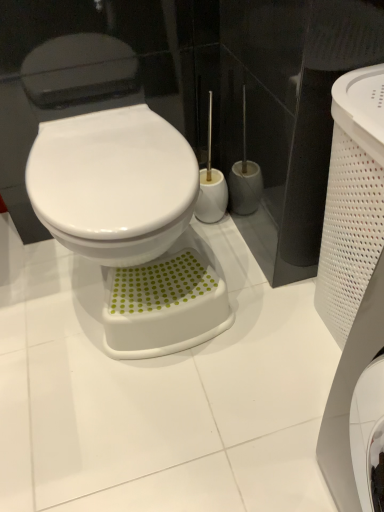
Question: Can you confirm if green dotted plastic step stool at lower center is positioned to the left of white glossy bidet at center?

Choices:
 (A) no
 (B) yes

Answer: (A)

Question: Can you confirm if green dotted plastic step stool at lower center is positioned to the right of white glossy bidet at center?

Choices:
 (A) yes
 (B) no

Answer: (A)

Question: Is green dotted plastic step stool at lower center outside white glossy bidet at center?

Choices:
 (A) no
 (B) yes

Answer: (B)

Question: Is green dotted plastic step stool at lower center looking in the opposite direction of white glossy bidet at center?

Choices:
 (A) yes
 (B) no

Answer: (B)

Question: From a real-world perspective, is green dotted plastic step stool at lower center physically below white glossy bidet at center?

Choices:
 (A) yes
 (B) no

Answer: (A)

Question: Is green dotted plastic step stool at lower center bigger than white glossy bidet at center?

Choices:
 (A) no
 (B) yes

Answer: (A)

Question: Is white glossy bidet at center next to green dotted plastic step stool at lower center and touching it?

Choices:
 (A) yes
 (B) no

Answer: (B)

Question: Does white glossy bidet at center lie behind green dotted plastic step stool at lower center?

Choices:
 (A) no
 (B) yes

Answer: (A)

Question: Considering the relative positions of white glossy bidet at center and green dotted plastic step stool at lower center in the image provided, is white glossy bidet at center to the right of green dotted plastic step stool at lower center from the viewer's perspective?

Choices:
 (A) yes
 (B) no

Answer: (B)

Question: Is white glossy bidet at center at the left side of green dotted plastic step stool at lower center?

Choices:
 (A) yes
 (B) no

Answer: (A)

Question: Could you tell me if white glossy bidet at center is facing green dotted plastic step stool at lower center?

Choices:
 (A) no
 (B) yes

Answer: (A)

Question: Is white glossy bidet at center positioned in front of green dotted plastic step stool at lower center?

Choices:
 (A) yes
 (B) no

Answer: (A)

Question: From the image's perspective, is white glossy bidet at center located above or below green dotted plastic step stool at lower center?

Choices:
 (A) below
 (B) above

Answer: (B)